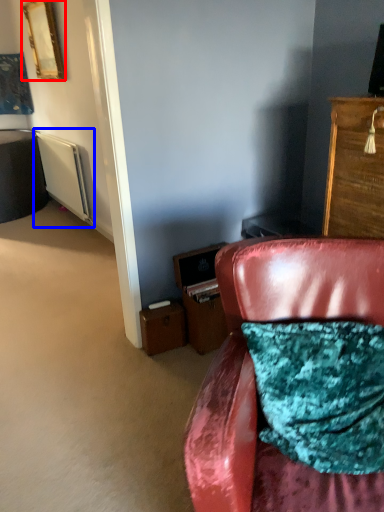
Question: Which object is further to the camera taking this photo, picture frame (highlighted by a red box) or radiator (highlighted by a blue box)?

Choices:
 (A) picture frame
 (B) radiator

Answer: (B)